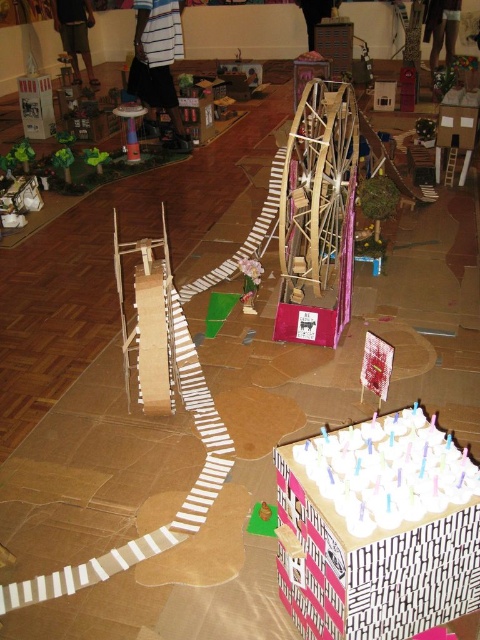
Question: Among these objects, which one is farthest from the camera?

Choices:
 (A) metallic silver tower at center
 (B) white striped cake at lower right
 (C) striped fabric shirt at upper center

Answer: (A)

Question: Estimate the real-world distances between objects in this image. Which object is farther from the white striped cake at lower right?

Choices:
 (A) striped fabric shirt at upper center
 (B) metallic silver tower at center

Answer: (A)

Question: Among these points, which one is farthest from the camera?

Choices:
 (A) (447, 467)
 (B) (155, 68)
 (C) (119, 109)

Answer: (B)

Question: Is white striped cake at lower right closer to the viewer compared to striped fabric shirt at upper center?

Choices:
 (A) yes
 (B) no

Answer: (A)

Question: Does white striped cake at lower right appear on the right side of metallic silver tower at center?

Choices:
 (A) no
 (B) yes

Answer: (B)

Question: Does striped fabric shirt at upper center have a greater width compared to metallic silver tower at center?

Choices:
 (A) yes
 (B) no

Answer: (A)